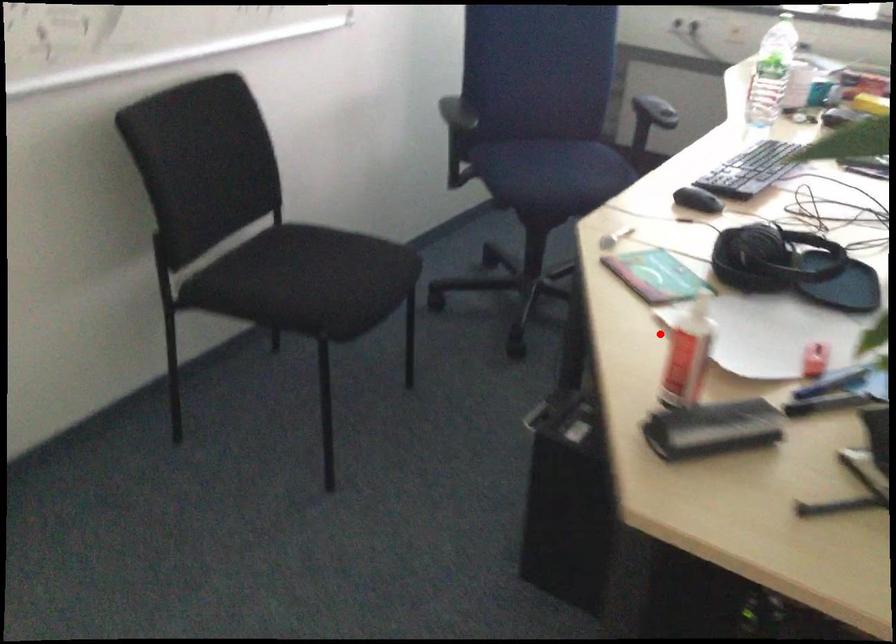
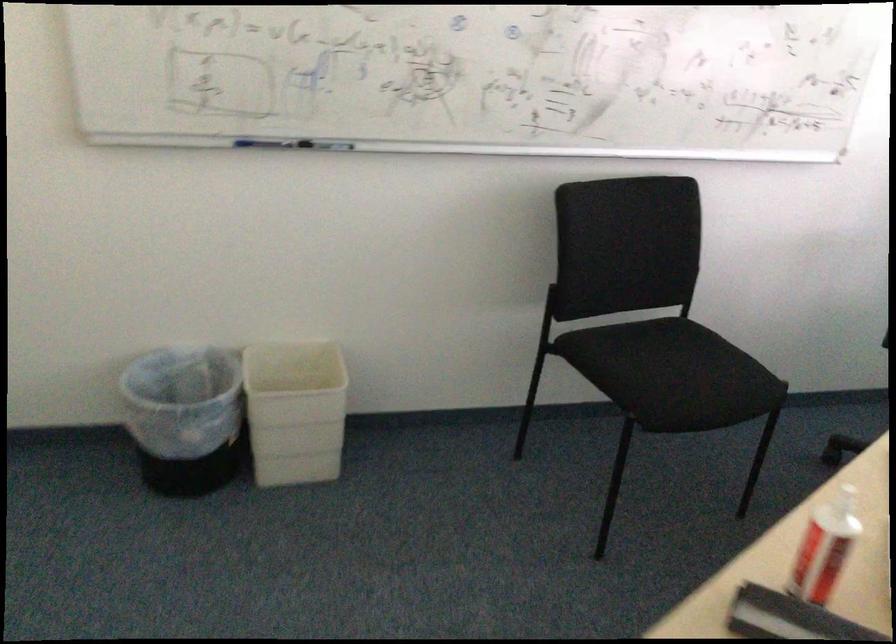
Question: I am providing you with two images of the same scene from different viewpoints. In image1, a red point is highlighted. Considering the same 3D point in image2, which of the following is correct?

Choices:
 (A) It is closer
 (B) It is farther

Answer: (A)